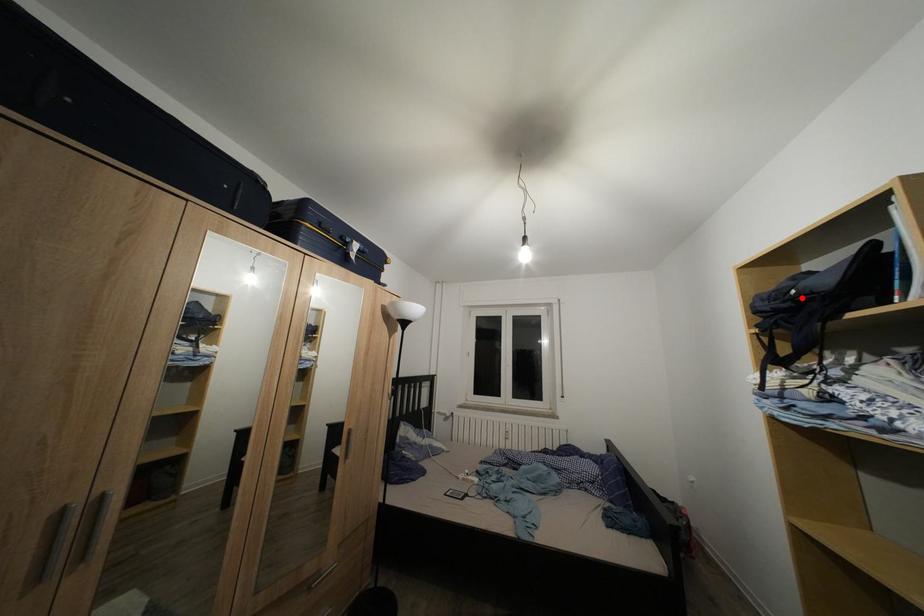
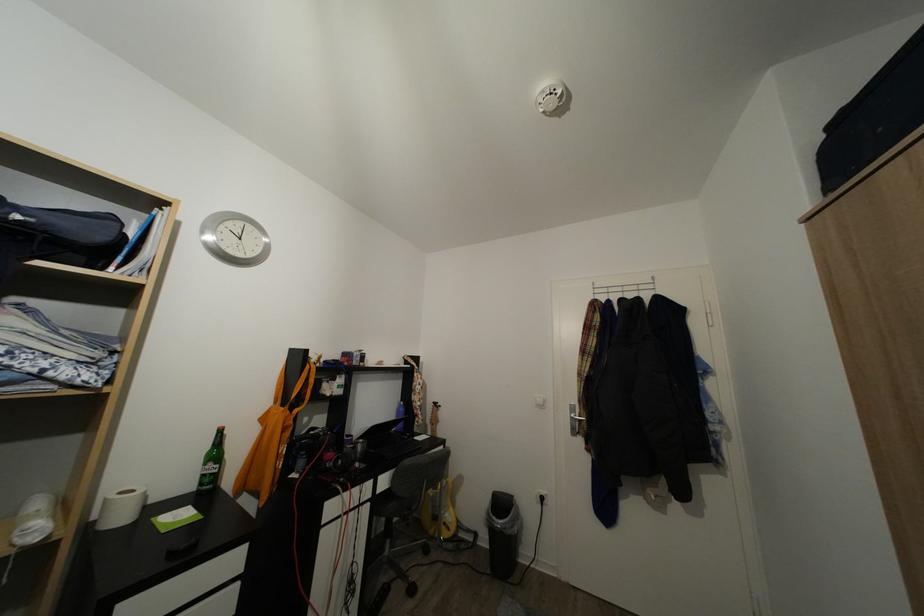
Locate, in the second image, the point that corresponds to the highlighted location in the first image.

(25, 223)